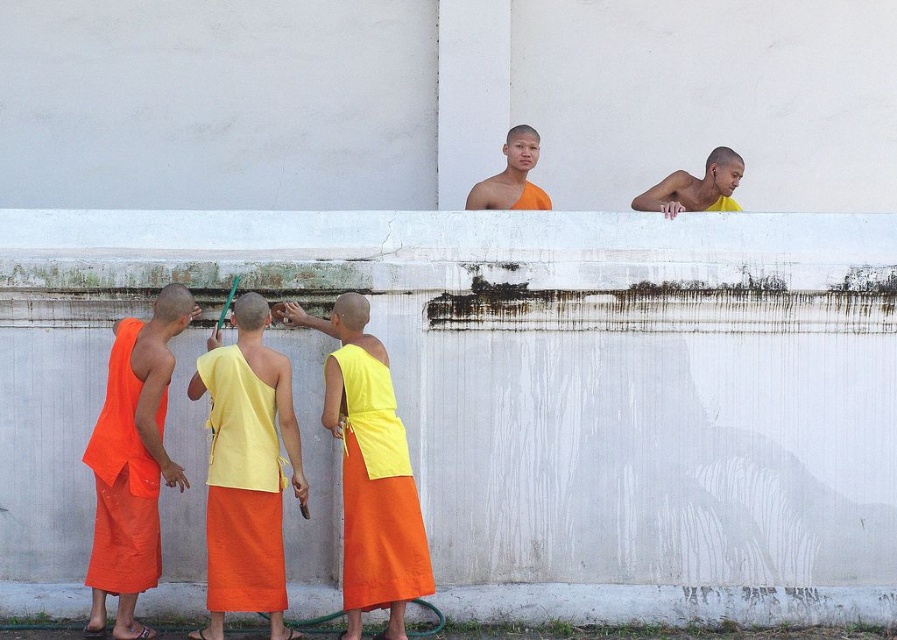
Question: Is orange cotton robe at left closer to the viewer compared to yellow matte monk at upper center?

Choices:
 (A) no
 (B) yes

Answer: (B)

Question: Where is orange cotton robe at left located in relation to yellow matte monk at upper center in the image?

Choices:
 (A) above
 (B) below

Answer: (B)

Question: Which of the following is the farthest from the observer?

Choices:
 (A) (511, 182)
 (B) (122, 499)
 (C) (708, 157)

Answer: (C)

Question: Can you confirm if orange cotton robe at left is positioned to the right of yellow matte monk at upper center?

Choices:
 (A) no
 (B) yes

Answer: (A)

Question: Which object appears farthest from the camera in this image?

Choices:
 (A) yellow cotton robe at center
 (B) orange cotton robe at left
 (C) orange cloth monk at upper center
 (D) yellow matte cloth at center

Answer: (C)

Question: Among these objects, which one is farthest from the camera?

Choices:
 (A) yellow matte cloth at center
 (B) orange cotton robe at left
 (C) orange cloth monk at upper center

Answer: (C)